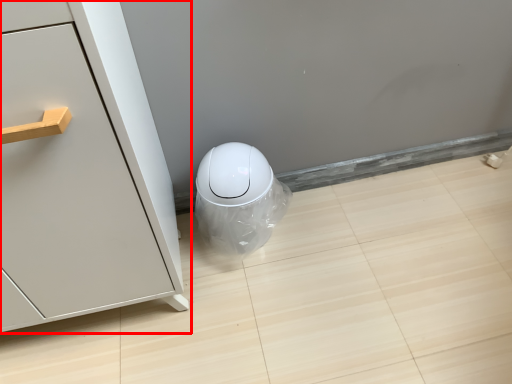
Question: From the image's perspective, what is the correct spatial positioning of furniture (annotated by the red box) in reference to porcelain?

Choices:
 (A) above
 (B) below

Answer: (A)